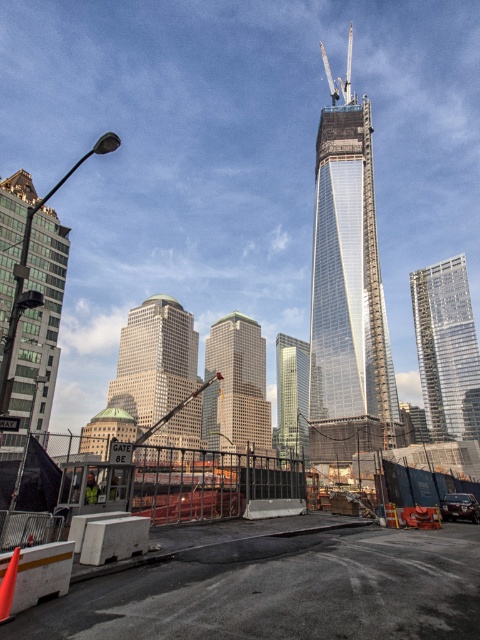
Is matte glass skyscraper at center smaller than glassy reflective skyscraper at center?

Yes.

Does matte glass skyscraper at center have a greater height compared to glassy reflective skyscraper at center?

Indeed, matte glass skyscraper at center has a greater height compared to glassy reflective skyscraper at center.

Locate an element on the screen. This screenshot has width=480, height=640. matte glass skyscraper at center is located at coordinates (155, 360).

Identify the location of matte glass skyscraper at center. (155, 360).

Is point (172, 298) closer to camera compared to point (87, 499)?

No.

Does point (163, 404) come farther from viewer compared to point (96, 486)?

That is True.

Where is `matte glass skyscraper at center`? matte glass skyscraper at center is located at coordinates (155, 360).

Who is positioned more to the left, glassy reflective skyscraper at right or yellow reflective safety vest at lower left?

yellow reflective safety vest at lower left

Between point (478, 365) and point (90, 486), which one is positioned in front?

Point (90, 486)

The image size is (480, 640). In order to click on glassy reflective skyscraper at right in this screenshot , I will do `click(446, 349)`.